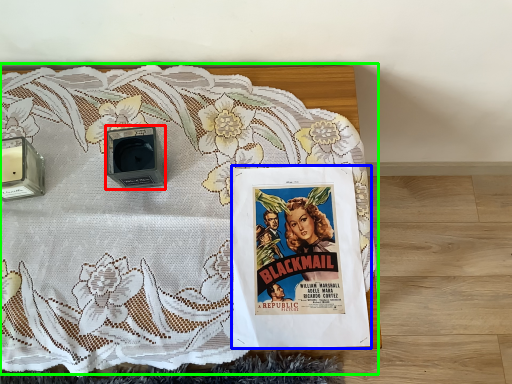
Question: Estimate the real-world distances between objects in this image. Which object is closer to speaker (highlighted by a red box), comic book (highlighted by a blue box) or bed (highlighted by a green box)?

Choices:
 (A) comic book
 (B) bed

Answer: (B)